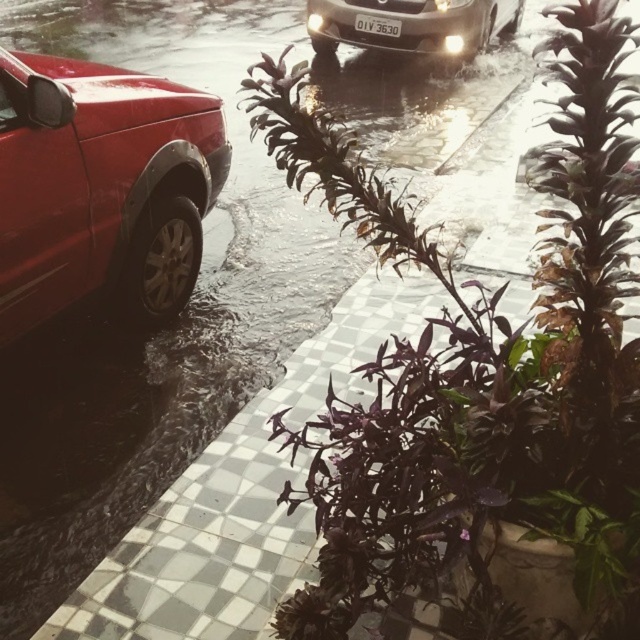
Locate an element on the screen. This screenshot has width=640, height=640. purple matte plant at center is located at coordinates (477, 362).

Does purple matte plant at center appear on the right side of matte red car at left?

Indeed, purple matte plant at center is positioned on the right side of matte red car at left.

Is point (305, 72) more distant than point (38, 84)?

No, it is not.

Locate an element on the screen. purple matte plant at center is located at coordinates (477, 362).

Does purple matte plant at center have a greater height compared to sleek silver sedan at upper center?

In fact, purple matte plant at center may be shorter than sleek silver sedan at upper center.

Who is more distant from viewer, [365,442] or [320,26]?

Positioned behind is point [320,26].

The image size is (640, 640). In order to click on purple matte plant at center in this screenshot , I will do `click(477, 362)`.

Who is shorter, purple matte plant at center or white plastic license plate at center?

Standing shorter between the two is white plastic license plate at center.

Who is positioned more to the left, purple matte plant at center or white plastic license plate at center?

white plastic license plate at center

What do you see at coordinates (477, 362) in the screenshot? I see `purple matte plant at center` at bounding box center [477, 362].

Locate an element on the screen. purple matte plant at center is located at coordinates (477, 362).